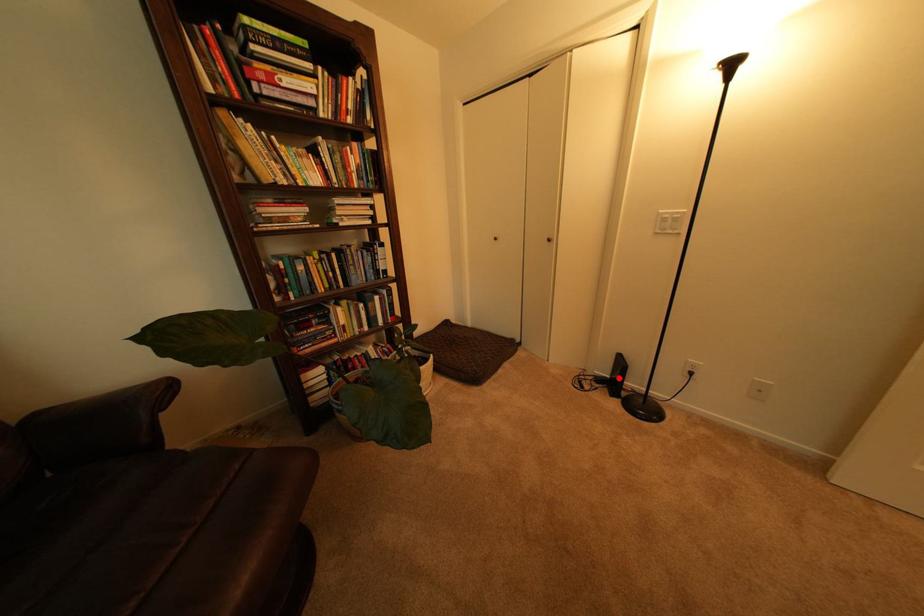
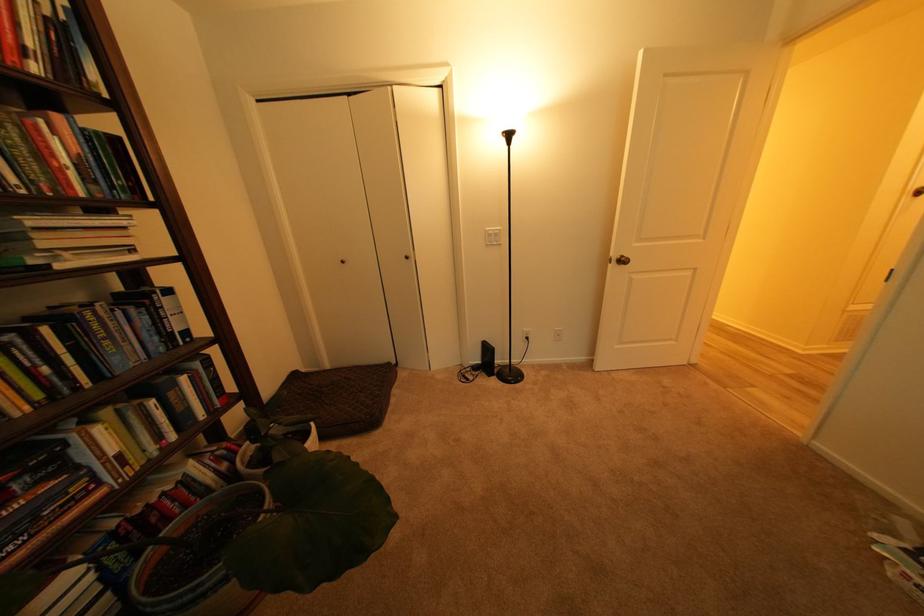
The point at the highlighted location is marked in the first image. Where is the corresponding point in the second image?

(490, 363)